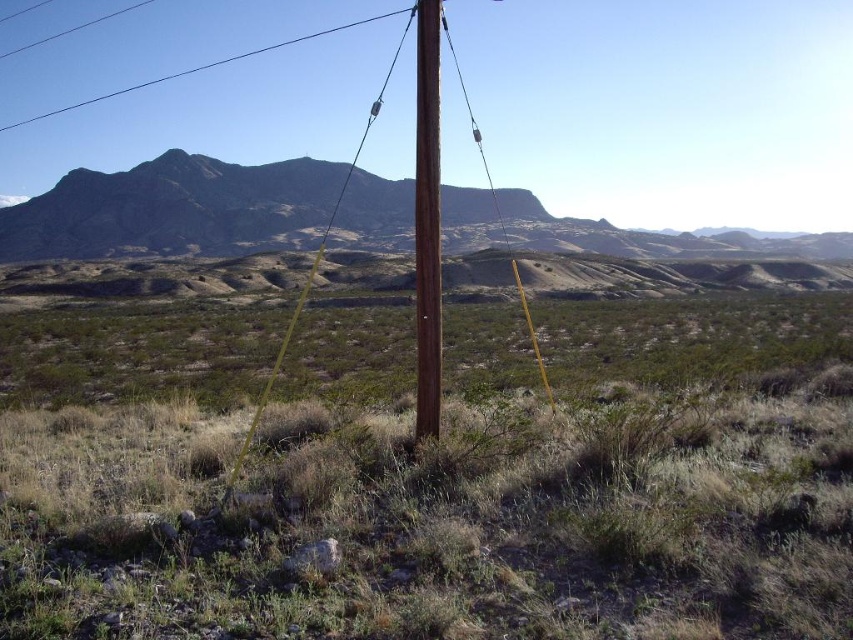
Question: Estimate the real-world distances between objects in this image. Which object is farther from the yellow plastic pole at center?

Choices:
 (A) brown wooden pole at center
 (B) green grass at center
 (C) smooth wire at upper center

Answer: (C)

Question: Is green grass at center positioned in front of brown wooden pole at center?

Choices:
 (A) yes
 (B) no

Answer: (A)

Question: Among these objects, which one is nearest to the camera?

Choices:
 (A) smooth wire at upper center
 (B) brown wood pole at center

Answer: (B)

Question: Does green grass at center have a larger size compared to yellow plastic pole at center?

Choices:
 (A) yes
 (B) no

Answer: (B)

Question: Does smooth wire at upper center appear on the right side of yellow plastic pole at center?

Choices:
 (A) no
 (B) yes

Answer: (A)

Question: Among these objects, which one is nearest to the camera?

Choices:
 (A) yellow plastic pole at center
 (B) brown wood pole at center

Answer: (B)